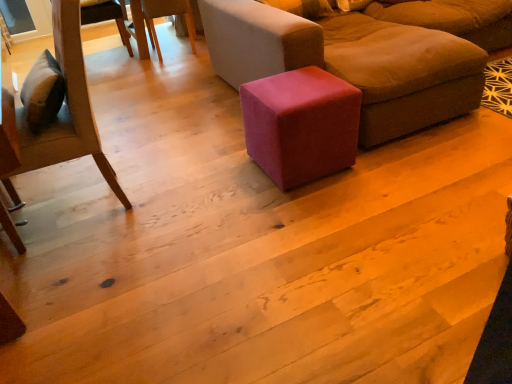
Where is `vacant space in between wooden chair at left, which appears as the 1th chair when viewed from the front, and velvet pink cube at center`? The height and width of the screenshot is (384, 512). vacant space in between wooden chair at left, which appears as the 1th chair when viewed from the front, and velvet pink cube at center is located at coordinates (192, 179).